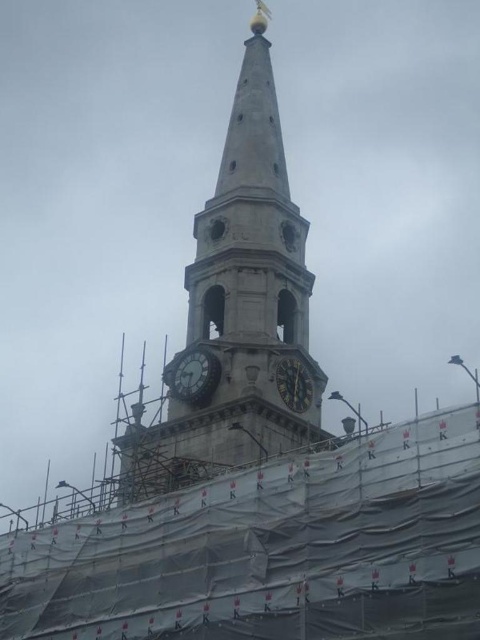
You are standing at the base of the church tower and want to take a photo of the point at coordinates point (157, 490). Your camera has a maximum focus range of 250 feet. Will the camera be able to focus on the point?

The distance of point (157, 490) from camera is 244.41 feet, which is within the camera maximum focus range of 250 feet. So the camera can focus on the point.

You are a construction worker needing to move a 4.5 meter long beam from the dark gray stone clock at center to the gold textured clock at center. Can you move it without bending the beam?

The distance between the dark gray stone clock at center and the gold textured clock at center is 4.33 meters. Since the beam is 4.5 meters long, it is slightly longer than the distance between them. Therefore, you cannot move the beam without bending it.